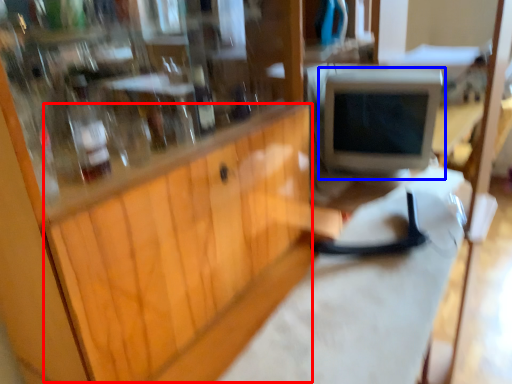
Question: Which object appears farthest to the camera in this image, wood (highlighted by a red box) or computer monitor (highlighted by a blue box)?

Choices:
 (A) wood
 (B) computer monitor

Answer: (B)